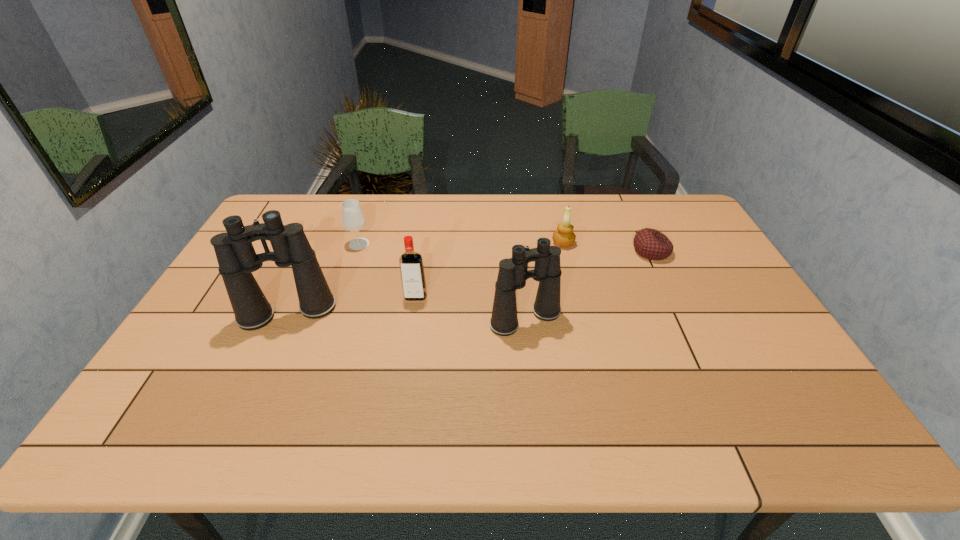
Where is `the third closest object to the candle_holder`? This screenshot has height=540, width=960. the third closest object to the candle_holder is located at coordinates (411, 265).

You are a GUI agent. You are given a task and a screenshot of the screen. Output one action in this format:
    pyautogui.click(x=<x>, y=<y>)
    Task: Click on the object that is the second closest to the beanbag
    Image resolution: width=960 pixels, height=540 pixels.
    Given the screenshot: What is the action you would take?
    pyautogui.click(x=513, y=273)

The image size is (960, 540). What are the coordinates of `vacant point that satisfies the following two spatial constraints: 1. on the back side of the beanbag; 2. on the right side of the fifth shortest object` in the screenshot? It's located at (518, 252).

Locate an element on the screen. vacant area in the image that satisfies the following two spatial constraints: 1. on the front side of the glass; 2. on the right side of the right binoculars is located at coordinates (333, 319).

Identify the location of vacant region that satisfies the following two spatial constraints: 1. on the front side of the second tallest object; 2. on the left side of the glass. (333, 319).

You are a GUI agent. You are given a task and a screenshot of the screen. Output one action in this format:
    pyautogui.click(x=<x>, y=<y>)
    Task: Click on the vacant point that satisfies the following two spatial constraints: 1. on the back side of the rightmost object; 2. on the left side of the shorter binoculars
    
    Given the screenshot: What is the action you would take?
    pyautogui.click(x=518, y=252)

You are a GUI agent. You are given a task and a screenshot of the screen. Output one action in this format:
    pyautogui.click(x=<x>, y=<y>)
    Task: Click on the blank space that satisfies the following two spatial constraints: 1. on the front side of the tallest object; 2. on the right side of the shorter binoculars
    Image resolution: width=960 pixels, height=540 pixels.
    Given the screenshot: What is the action you would take?
    pyautogui.click(x=285, y=319)